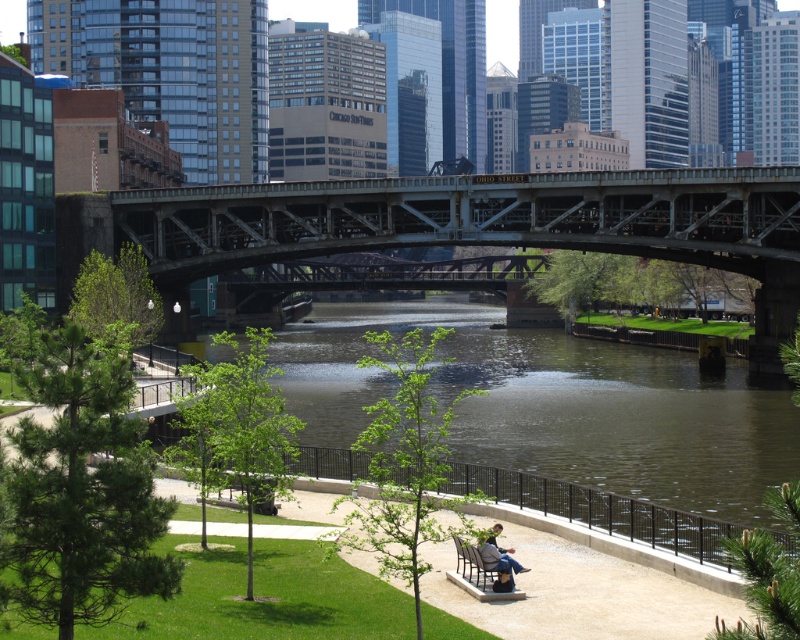
Question: Does metallic gray bridge at center appear over denim jeans at lower center?

Choices:
 (A) no
 (B) yes

Answer: (B)

Question: Estimate the real-world distances between objects in this image. Which object is closer to the denim jeans at lower center?

Choices:
 (A) green water at center
 (B) metallic gray bridge at center
 (C) wooden bench at lower center

Answer: (C)

Question: Is green water at center positioned in front of denim jeans at lower center?

Choices:
 (A) no
 (B) yes

Answer: (B)

Question: Does metallic gray bridge at center appear over wooden bench at lower center?

Choices:
 (A) yes
 (B) no

Answer: (A)

Question: Which object is farther from the camera taking this photo?

Choices:
 (A) wooden bench at lower center
 (B) denim jeans at lower center
 (C) metallic gray bridge at center
 (D) green water at center

Answer: (C)

Question: Which object appears closest to the camera in this image?

Choices:
 (A) wooden bench at lower center
 (B) green water at center
 (C) metallic gray bridge at center
 (D) denim jeans at lower center

Answer: (B)